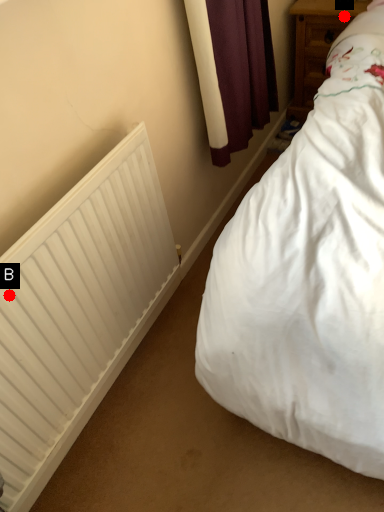
Question: Two points are circled on the image, labeled by A and B beside each circle. Which point is farther from the camera taking this photo?

Choices:
 (A) A is further
 (B) B is further

Answer: (A)